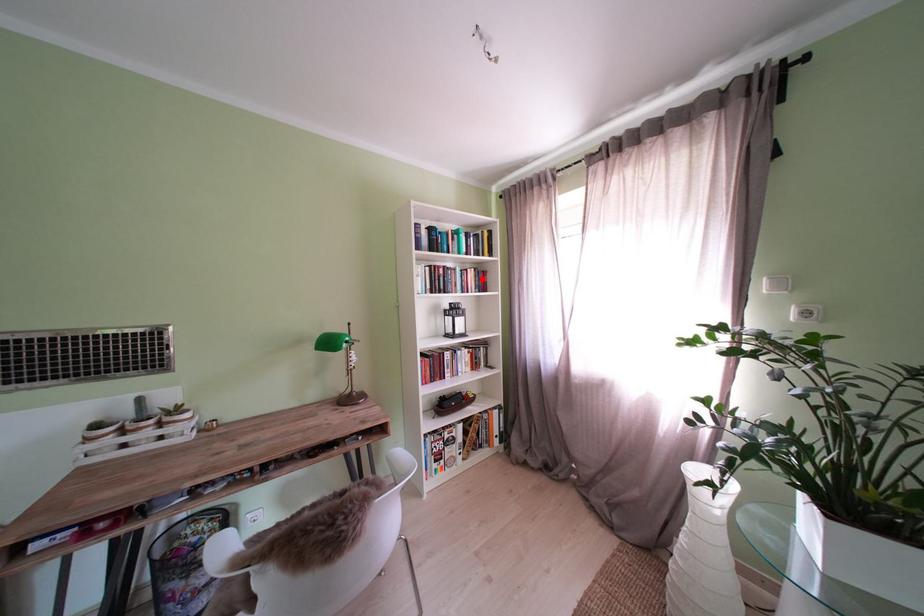
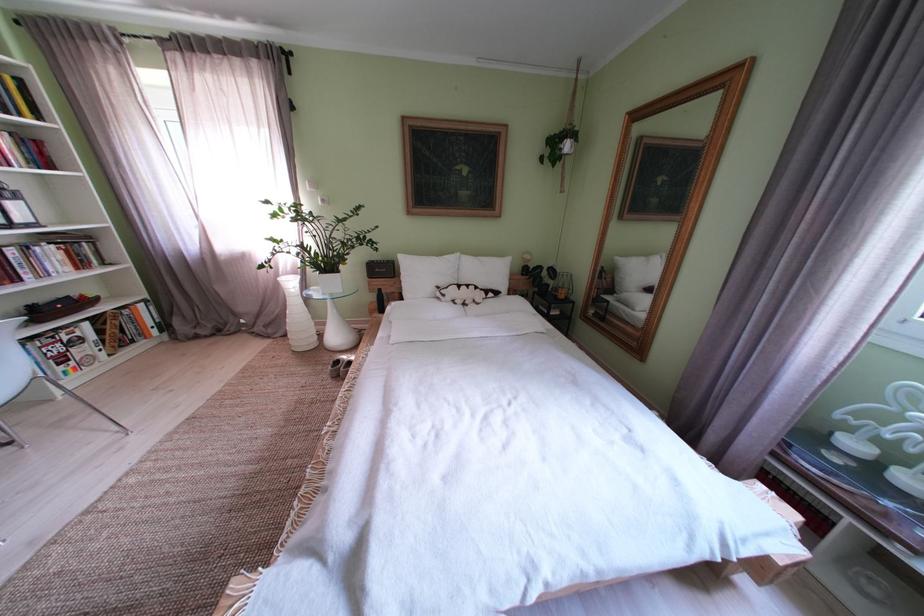
Locate, in the second image, the point that corresponds to the highlighted location in the first image.

(16, 145)